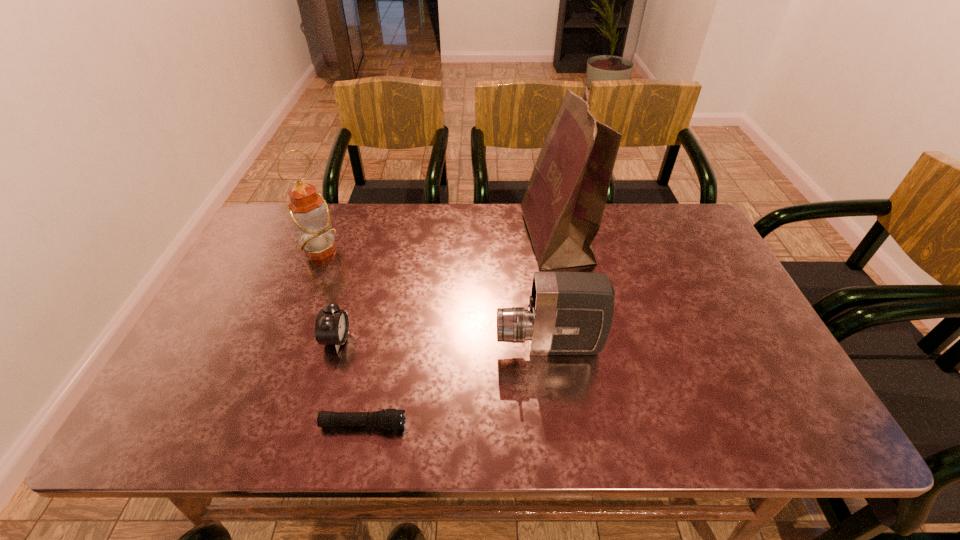
At what (x,y) coordinates should I click in order to perform the action: click on vacant region at the near edge of the desktop. Please return your answer as a coordinate pair (x, y). Looking at the image, I should click on (665, 417).

At what (x,y) coordinates should I click in order to perform the action: click on vacant space at the left edge of the desktop. Please return your answer as a coordinate pair (x, y). Looking at the image, I should click on (225, 340).

This screenshot has height=540, width=960. Identify the location of vacant space at the right edge of the desktop. (789, 398).

Find the location of a particular element. free location at the far right corner is located at coordinates (695, 229).

You are a GUI agent. You are given a task and a screenshot of the screen. Output one action in this format:
    pyautogui.click(x=<x>, y=<y>)
    Task: Click on the free space at the near right corner of the desktop
    
    Given the screenshot: What is the action you would take?
    pyautogui.click(x=788, y=442)

The width and height of the screenshot is (960, 540). Identify the location of unoccupied area between the second shortest object and the flashlight. (349, 382).

Image resolution: width=960 pixels, height=540 pixels. Identify the location of vacant space in between the flashlight and the camcorder. (456, 385).

At what (x,y) coordinates should I click in order to perform the action: click on free space that is in between the shortest object and the tallest object. Please return your answer as a coordinate pair (x, y). The image size is (960, 540). Looking at the image, I should click on (460, 331).

In order to click on free space between the alarm clock and the tallest object in this screenshot , I will do `click(446, 289)`.

The image size is (960, 540). Identify the location of vacant point located between the fourth tallest object and the flashlight. (349, 382).